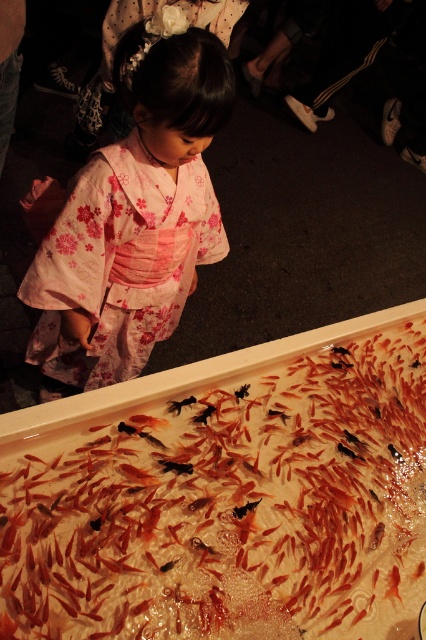
Question: Can you confirm if translucent plastic tray at lower center is positioned to the left of pink floral kimono at center?

Choices:
 (A) yes
 (B) no

Answer: (B)

Question: Is translucent plastic tray at lower center thinner than black glossy fish at center?

Choices:
 (A) yes
 (B) no

Answer: (B)

Question: Which point appears farthest from the camera in this image?

Choices:
 (A) pos(172,406)
 (B) pos(46,492)

Answer: (A)

Question: Can you confirm if translucent plastic tray at lower center is wider than pink floral kimono at center?

Choices:
 (A) yes
 (B) no

Answer: (A)

Question: Which of the following is the farthest from the observer?

Choices:
 (A) black glossy fish at center
 (B) translucent plastic tray at lower center

Answer: (A)

Question: Considering the real-world distances, which object is closest to the pink floral kimono at center?

Choices:
 (A) translucent plastic tray at lower center
 (B) black glossy fish at center

Answer: (B)